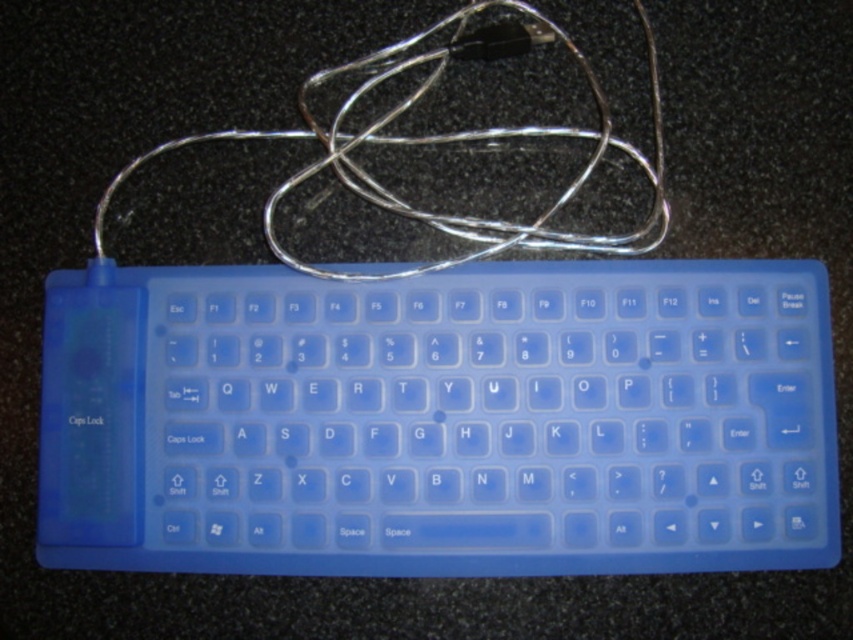
Can you confirm if translucent blue keyboard at center is smaller than silver metallic wire at upper center?

Yes, translucent blue keyboard at center is smaller than silver metallic wire at upper center.

Does translucent blue keyboard at center appear on the left side of silver metallic wire at upper center?

No, translucent blue keyboard at center is not to the left of silver metallic wire at upper center.

Who is more forward, (51, 294) or (635, 148)?

Point (51, 294)

Find the location of a particular element. Image resolution: width=853 pixels, height=640 pixels. translucent blue keyboard at center is located at coordinates (440, 420).